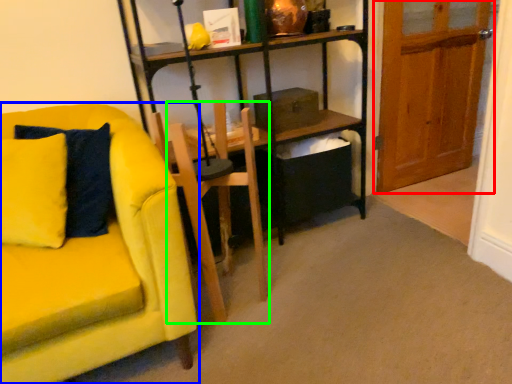
Question: Which object is the farthest from door (highlighted by a red box)? Choose among these: chair (highlighted by a blue box) or armchair (highlighted by a green box).

Choices:
 (A) chair
 (B) armchair

Answer: (A)